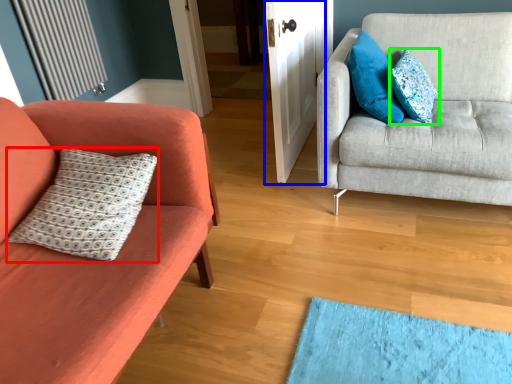
Question: Which is farther away from pillow (highlighted by a red box)? door (highlighted by a blue box) or pillow (highlighted by a green box)?

Choices:
 (A) door
 (B) pillow

Answer: (B)